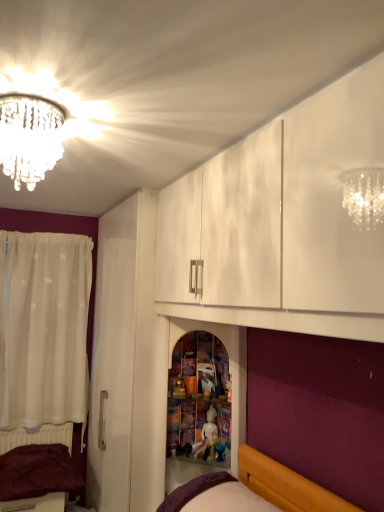
Question: Based on their positions, is wooden shelf at center located to the left or right of purple fabric bed at lower left, positioned as the first bed in back-to-front order?

Choices:
 (A) left
 (B) right

Answer: (B)

Question: Considering the positions of point (198, 345) and point (82, 488), is point (198, 345) closer or farther from the camera than point (82, 488)?

Choices:
 (A) farther
 (B) closer

Answer: (B)

Question: Considering the real-world distances, which object is closest to the wooden shelf at center?

Choices:
 (A) crystal chandelier at upper left
 (B) purple fabric bed at lower center, arranged as the first bed when viewed from the front
 (C) white glossy statue at center
 (D) purple fabric bed at lower left, which is the second bed in top-to-bottom order
 (E) white sheer curtain at left

Answer: (C)

Question: Which object is positioned closest to the white sheer curtain at left?

Choices:
 (A) crystal chandelier at upper left
 (B) white glossy statue at center
 (C) wooden shelf at center
 (D) purple fabric bed at lower left, positioned as the first bed in back-to-front order
 (E) purple fabric bed at lower center, the 2th bed viewed from the left

Answer: (D)